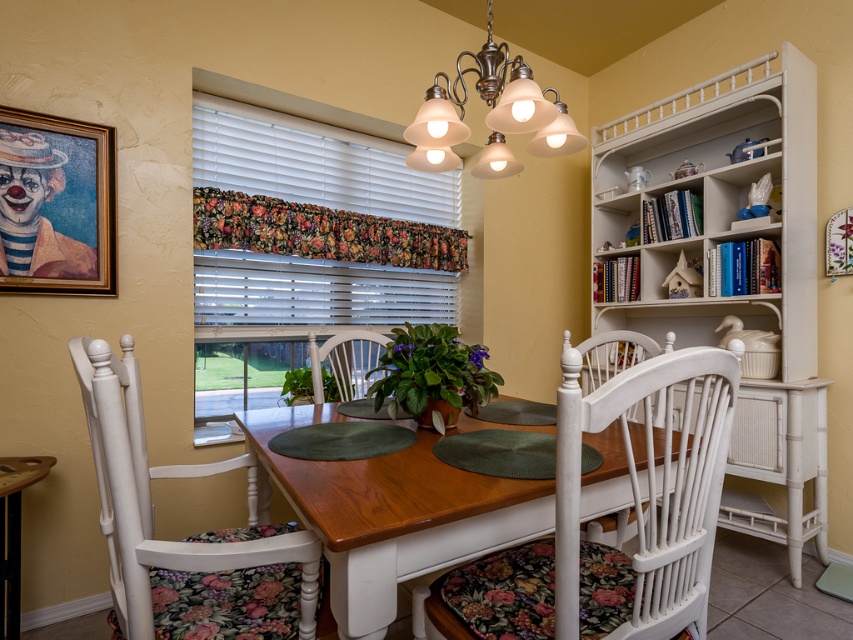
You are a painter who wants to hang a new painting between the white blinds at upper center and the metallic frosted glass chandelier at upper center. The painting is 20 inches wide. Can you fit it in the space between them?

The space between the white blinds at upper center and the metallic frosted glass chandelier at upper center is 39.06 inches. Since the painting is 20 inches wide, it can fit in the available space as 20 is less than 39.06.